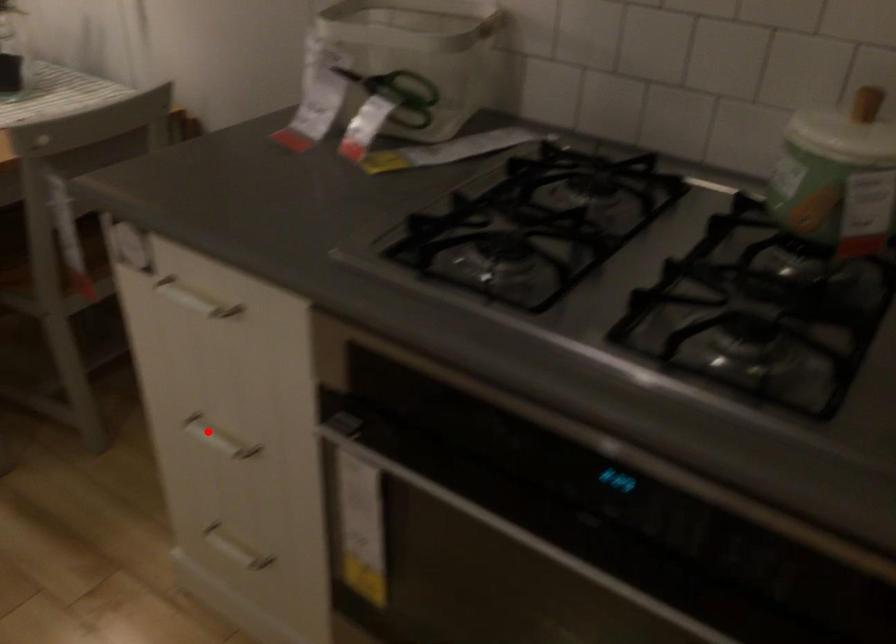
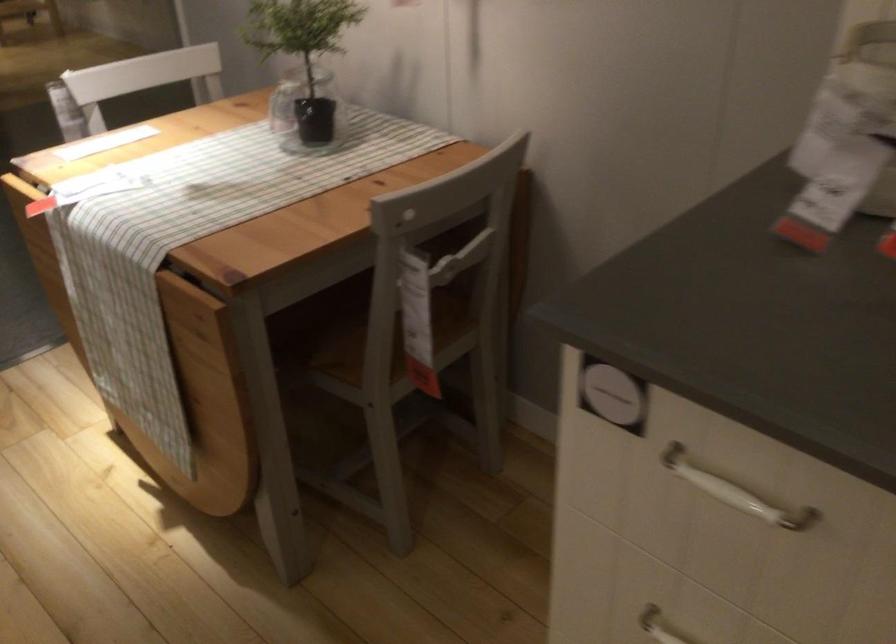
Question: I am providing you with two images of the same scene from different viewpoints. Given a red point in image1, look at the same physical point in image2. Is it:

Choices:
 (A) Closer to the viewpoint
 (B) Farther from the viewpoint

Answer: (A)